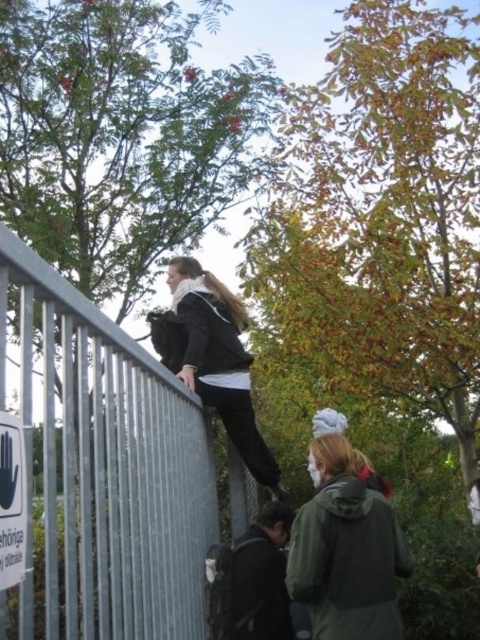
Question: Which point is closer to the camera?

Choices:
 (A) (249, 390)
 (B) (168, 548)

Answer: (B)

Question: Which of the following is the farthest from the observer?

Choices:
 (A) green matte jacket at lower right
 (B) matte black jacket at upper center
 (C) metallic gray fence at upper left

Answer: (B)

Question: Is metallic gray fence at upper left to the right of matte black jacket at upper center from the viewer's perspective?

Choices:
 (A) yes
 (B) no

Answer: (B)

Question: Based on their relative distances, which object is farther from the metallic gray fence at upper left?

Choices:
 (A) matte black jacket at upper center
 (B) green matte jacket at lower right

Answer: (A)

Question: Where is green matte jacket at lower right located in relation to matte black jacket at upper center in the image?

Choices:
 (A) left
 (B) right

Answer: (B)

Question: Does green matte jacket at lower right appear on the left side of matte black jacket at upper center?

Choices:
 (A) no
 (B) yes

Answer: (A)